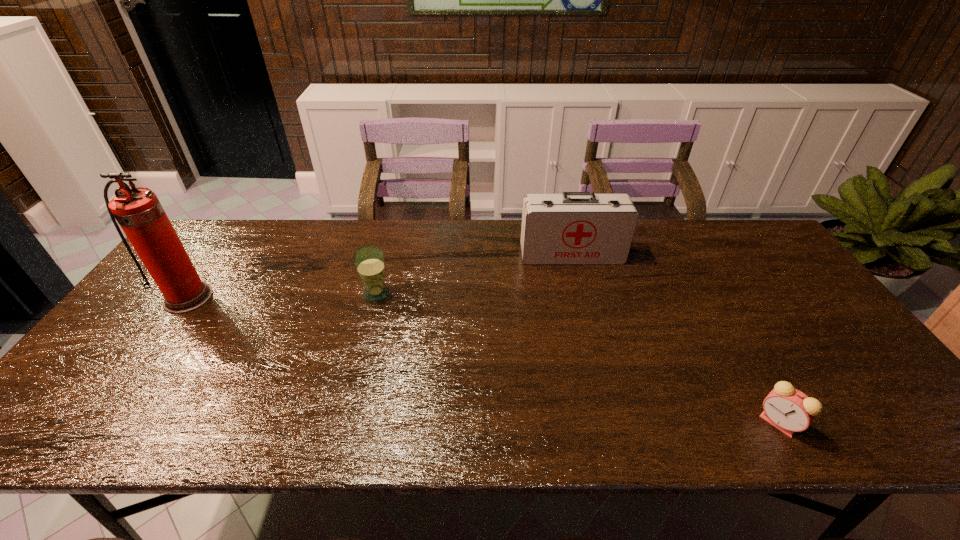
Locate which object ranks second in proximity to the second shortest object. Please provide its 2D coordinates. Your answer should be formatted as a tuple, i.e. [(x, y)], where the tuple contains the x and y coordinates of a point satisfying the conditions above.

[(138, 211)]

Locate an element on the screen. This screenshot has width=960, height=540. object that can be found as the closest to the second object from right to left is located at coordinates (369, 261).